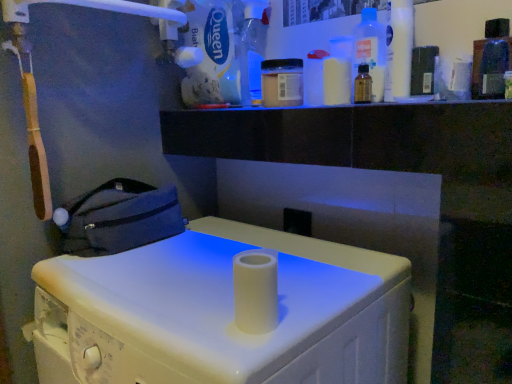
Question: Looking at their shapes, would you say white matte paper towel holder at center is wider or thinner than transparent plastic bottle at upper right, which is counted as the 4th bottle, starting from the left?

Choices:
 (A) wide
 (B) thin

Answer: (A)

Question: Is white matte paper towel holder at center taller or shorter than transparent plastic bottle at upper right, which is counted as the 4th bottle, starting from the left?

Choices:
 (A) short
 (B) tall

Answer: (B)

Question: Which is nearer to the transparent plastic bottle at upper right, which is counted as the 4th bottle, starting from the left?

Choices:
 (A) white matte paper towel holder at center
 (B) brown glass bottle at upper right, which is counted as the 3th bottle, starting from the left
 (C) white matte queen bath cleaner at upper center
 (D) translucent plastic bottle at upper right, the first bottle when ordered from right to left
 (E) dark blue fabric bag at left

Answer: (B)

Question: Estimate the real-world distances between objects in this image. Which object is farther from the white matte queen bath cleaner at upper center?

Choices:
 (A) brown glass bottle at upper right, positioned as the third bottle in right-to-left order
 (B) transparent plastic bottle at upper right, positioned as the 2th bottle in right-to-left order
 (C) white matte paper towel holder at center
 (D) translucent plastic bottle at upper right, which is the fifth bottle in left-to-right order
 (E) dark blue fabric bag at left

Answer: (D)